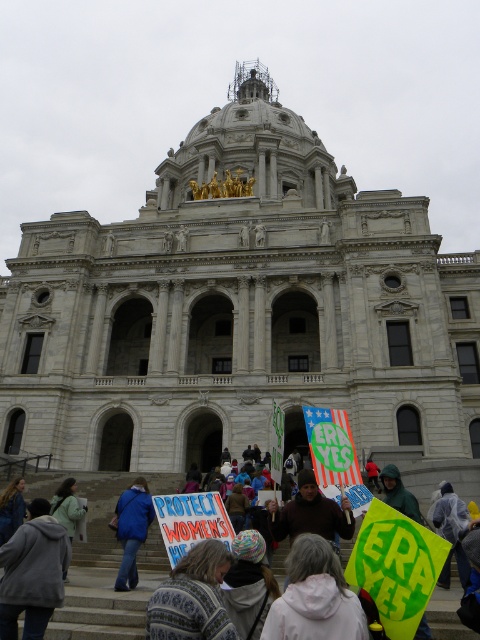
Question: Does knitted sweater at lower center have a greater width compared to blue fabric jacket at lower left?

Choices:
 (A) no
 (B) yes

Answer: (A)

Question: Considering the real-world distances, which object is farthest from the light green jacket at lower left?

Choices:
 (A) blue fabric jacket at lower left
 (B) white fleece jacket at lower center
 (C) gray hoodie at lower left
 (D) knitted sweater at lower center

Answer: (B)

Question: Can you confirm if white fleece jacket at lower center is smaller than light green jacket at lower left?

Choices:
 (A) no
 (B) yes

Answer: (B)

Question: Which object is positioned farthest from the white fleece jacket at lower center?

Choices:
 (A) light green jacket at lower left
 (B) knitted sweater at lower center

Answer: (A)

Question: Which object is the farthest from the white fleece jacket at lower center?

Choices:
 (A) light green jacket at lower left
 (B) gray hoodie at lower left

Answer: (A)

Question: Is knitted sweater at lower center to the right of blue fabric jacket at lower left from the viewer's perspective?

Choices:
 (A) yes
 (B) no

Answer: (A)